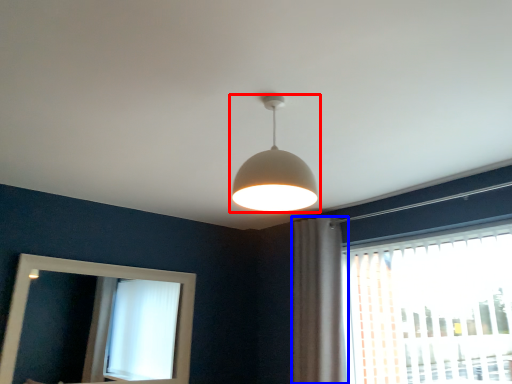
Question: Which point is further to the camera, lamp (highlighted by a red box) or curtain (highlighted by a blue box)?

Choices:
 (A) lamp
 (B) curtain

Answer: (B)